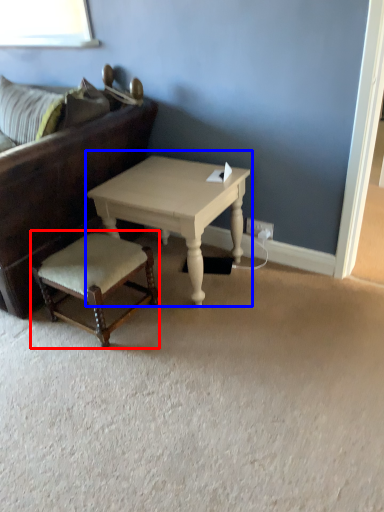
Question: Among these objects, which one is nearest to the camera, stool (highlighted by a red box) or coffee table (highlighted by a blue box)?

Choices:
 (A) stool
 (B) coffee table

Answer: (A)